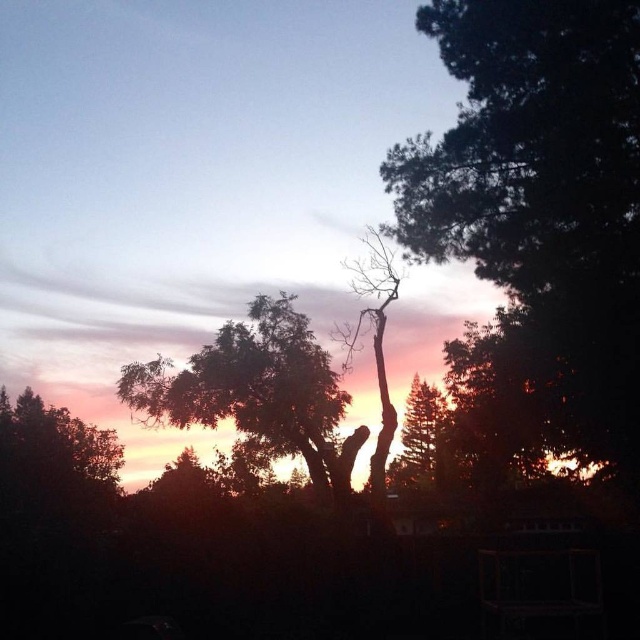
Who is positioned more to the left, dark green textured tree at right or silhouette bare tree at center?

silhouette bare tree at center

Which is above, dark green textured tree at right or silhouette bare tree at center?

dark green textured tree at right is higher up.

Is point (637, 372) positioned before point (385, 484)?

That is True.

You are a GUI agent. You are given a task and a screenshot of the screen. Output one action in this format:
    pyautogui.click(x=<x>, y=<y>)
    Task: Click on the dark green textured tree at right
    
    Given the screenshot: What is the action you would take?
    pyautogui.click(x=541, y=198)

Image resolution: width=640 pixels, height=640 pixels. I want to click on dark green textured tree at right, so click(541, 198).

Is point (531, 365) farther from viewer compared to point (412, 436)?

No, (531, 365) is in front of (412, 436).

Is point (508, 141) closer to viewer compared to point (419, 406)?

Yes, point (508, 141) is closer to viewer.

Locate an element on the screen. dark green textured tree at right is located at coordinates (541, 198).

Does dark green textured tree at right appear under green leafy tree at center?

Correct, dark green textured tree at right is located below green leafy tree at center.

Is point (481, 230) farther from camera compared to point (240, 378)?

No, (481, 230) is in front of (240, 378).

Between point (474, 1) and point (273, 449), which one is positioned behind?

The point (273, 449) is behind.

Identify the location of dark green textured tree at right. Image resolution: width=640 pixels, height=640 pixels. coord(541,198).